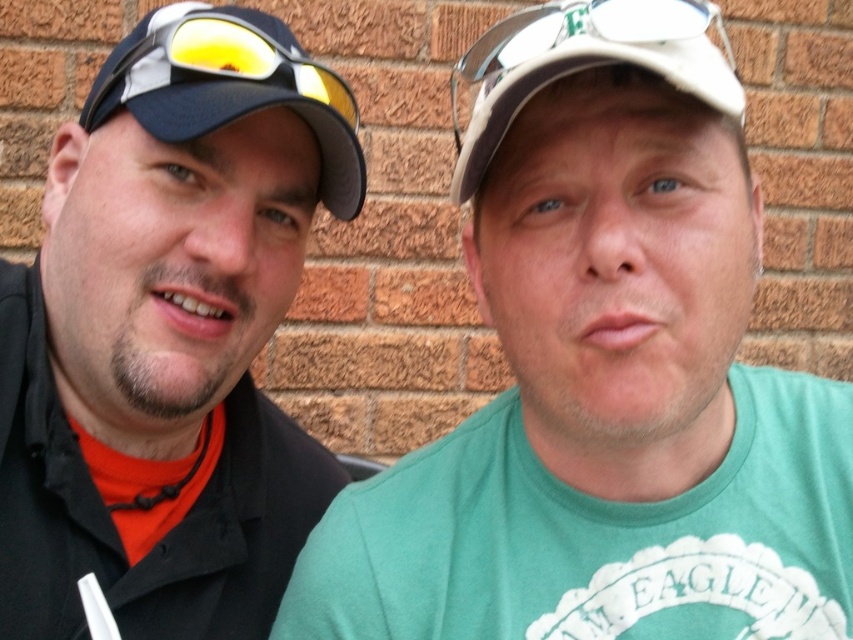
Is black matte cap at left closer to camera compared to white matte cap at center?

That is False.

What do you see at coordinates (165, 348) in the screenshot? The width and height of the screenshot is (853, 640). I see `black matte cap at left` at bounding box center [165, 348].

Between point (160, 392) and point (647, 51), which one is positioned in front?

Point (647, 51) is in front.

Where is `black matte cap at left`? black matte cap at left is located at coordinates (165, 348).

Is green fabric shirt at center bigger than white matte cap at center?

Correct, green fabric shirt at center is larger in size than white matte cap at center.

Can you confirm if green fabric shirt at center is shorter than white matte cap at center?

In fact, green fabric shirt at center may be taller than white matte cap at center.

Who is more distant from viewer, (486, 403) or (467, 83)?

Point (467, 83)

In order to click on green fabric shirt at center in this screenshot , I will do `click(602, 372)`.

Who is positioned more to the left, matte black cap at left or white matte cap at center?

matte black cap at left

Which is behind, point (308, 104) or point (636, 42)?

Positioned behind is point (308, 104).

Is point (282, 72) closer to camera compared to point (508, 45)?

No, it is not.

This screenshot has height=640, width=853. In order to click on matte black cap at left in this screenshot , I will do click(229, 86).